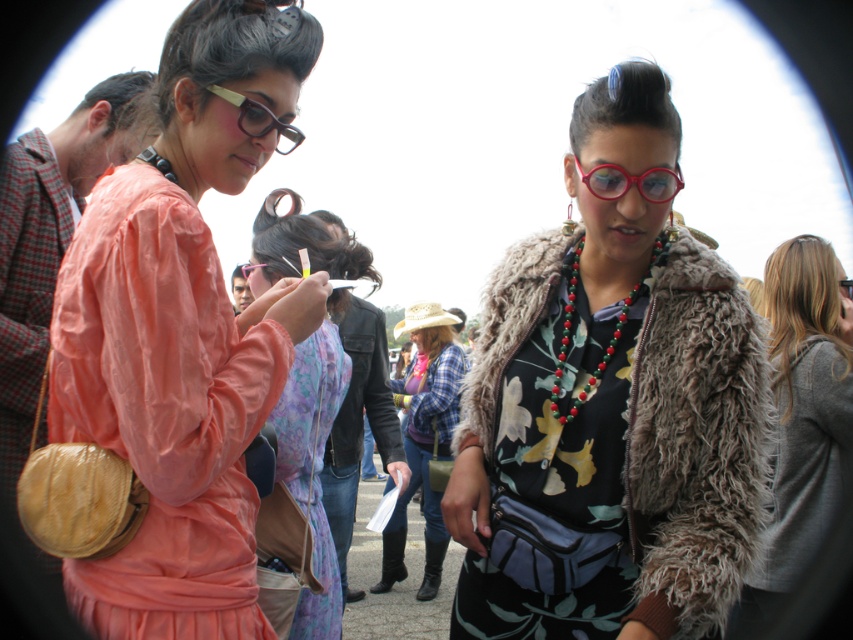
You are organizing a photo shoot and need to ensure that the two central outfits, the matte pink dress at center and the plaid fabric shirt at center, fit within a rectangular frame. Given that the frame is 1 meter wide, can both outfits be displayed side by side without overlapping?

The matte pink dress at center is wider than the plaid fabric shirt at center. Since the frame is 1 meter wide, the combined width of both outfits may exceed the frame if the dress is significantly wider. However, without exact measurements, it is uncertain. Please check the total width of both outfits to confirm.

You are standing in the scene and want to hand a gift to the person wearing the gray wool sweater at right and the matte pink dress at center. Which one can you reach first without moving closer?

The gray wool sweater at right is closer to the viewer than the matte pink dress at center, so you can reach the person wearing the gray wool sweater at right first without moving closer.